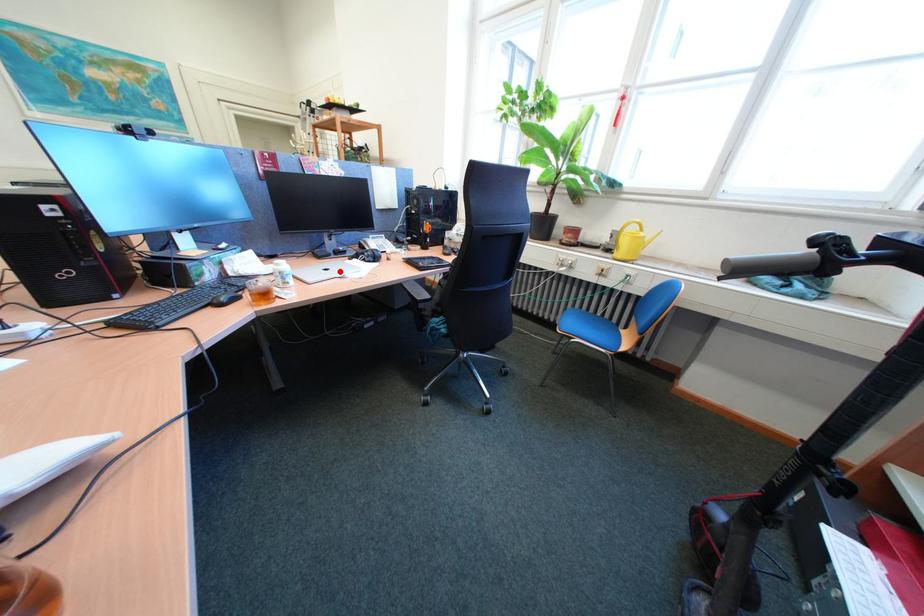
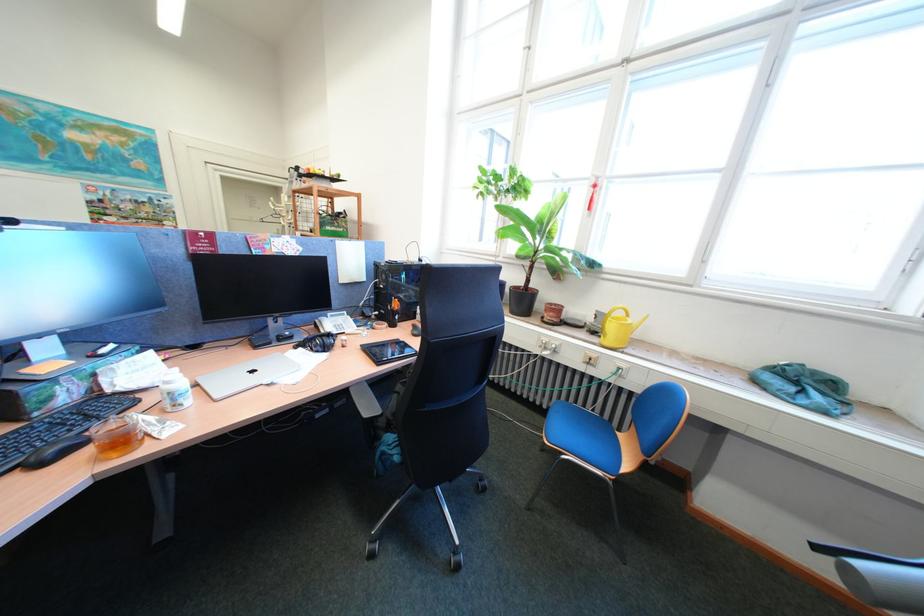
In the second image, find the point that corresponds to the highlighted location in the first image.

(265, 373)